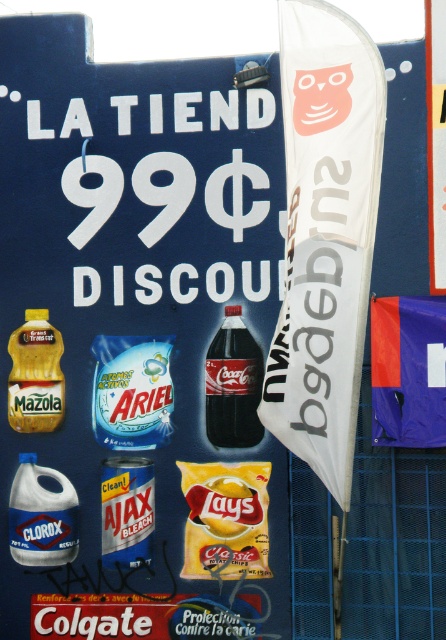
Question: Which point is closer to the camera taking this photo?

Choices:
 (A) (242, 508)
 (B) (215, 381)

Answer: (A)

Question: Does yellow matte lay's potato chips at center come behind dark brown glass bottle at center?

Choices:
 (A) no
 (B) yes

Answer: (B)

Question: Which point is farther to the camera?

Choices:
 (A) (231, 400)
 (B) (103, 385)

Answer: (B)

Question: Does blue glossy detergent at center appear on the left side of dark brown glass bottle at center?

Choices:
 (A) yes
 (B) no

Answer: (A)

Question: Which of the following is the farthest from the observer?

Choices:
 (A) (240, 436)
 (B) (238, 518)
 (C) (152, 419)

Answer: (C)

Question: Can you confirm if yellow matte lay's potato chips at center is smaller than blue glossy detergent at center?

Choices:
 (A) no
 (B) yes

Answer: (B)